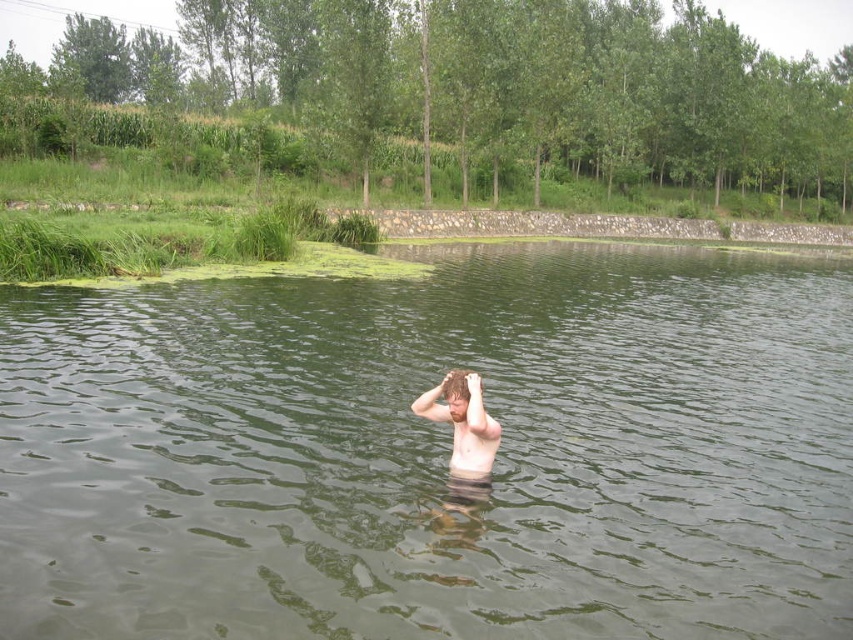
Does green murky water at center appear on the left side of brown hair at center?

Incorrect, green murky water at center is not on the left side of brown hair at center.

The width and height of the screenshot is (853, 640). I want to click on green murky water at center, so click(x=434, y=451).

Describe the element at coordinates (434, 451) in the screenshot. I see `green murky water at center` at that location.

At what (x,y) coordinates should I click in order to perform the action: click on green murky water at center. Please return your answer as a coordinate pair (x, y). Looking at the image, I should click on (434, 451).

Can you confirm if green murky water at center is smaller than skinny white skin at center?

No.

Who is positioned more to the left, green murky water at center or skinny white skin at center?

From the viewer's perspective, skinny white skin at center appears more on the left side.

Who is more forward, (x=502, y=355) or (x=468, y=461)?

Point (x=468, y=461) is more forward.

You are a GUI agent. You are given a task and a screenshot of the screen. Output one action in this format:
    pyautogui.click(x=<x>, y=<y>)
    Task: Click on the green murky water at center
    
    Given the screenshot: What is the action you would take?
    pyautogui.click(x=434, y=451)

Image resolution: width=853 pixels, height=640 pixels. What do you see at coordinates (463, 422) in the screenshot?
I see `light brown skin at center` at bounding box center [463, 422].

Who is lower down, light brown skin at center or brown hair at center?

light brown skin at center is below.

The image size is (853, 640). What do you see at coordinates (463, 422) in the screenshot? I see `light brown skin at center` at bounding box center [463, 422].

You are a GUI agent. You are given a task and a screenshot of the screen. Output one action in this format:
    pyautogui.click(x=<x>, y=<y>)
    Task: Click on the light brown skin at center
    The image size is (853, 640).
    Given the screenshot: What is the action you would take?
    pyautogui.click(x=463, y=422)